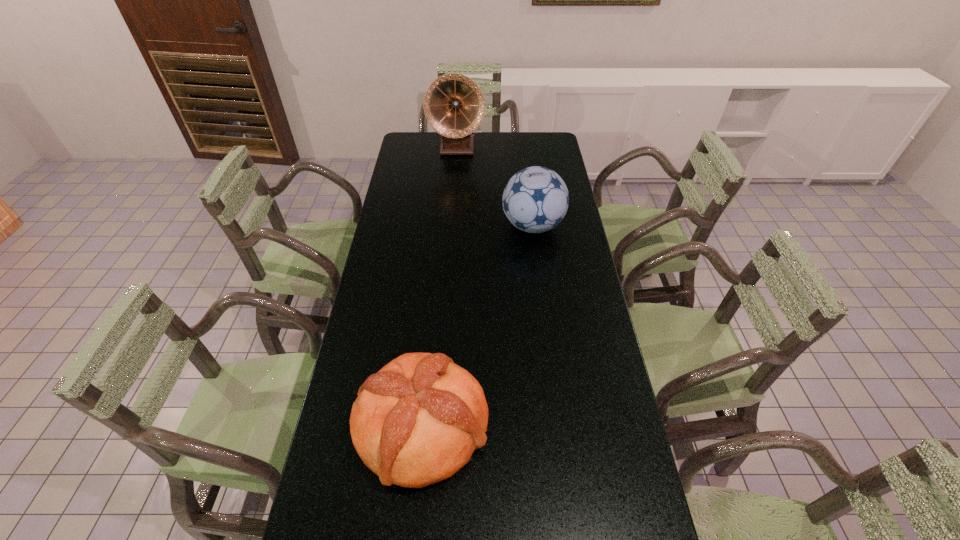
You are a GUI agent. You are given a task and a screenshot of the screen. Output one action in this format:
    pyautogui.click(x=<x>, y=<y>)
    Task: Click on the vacant space that is in between the second farthest object and the tallest object
    This screenshot has width=960, height=540.
    Given the screenshot: What is the action you would take?
    pyautogui.click(x=494, y=186)

The width and height of the screenshot is (960, 540). I want to click on empty location between the rightmost object and the phonograph record, so click(494, 186).

The image size is (960, 540). What are the coordinates of `free space between the shortest object and the tallest object` in the screenshot? It's located at (440, 286).

Locate which object is the closest to the tallest object. Please provide its 2D coordinates. Your answer should be formatted as a tuple, i.e. [(x, y)], where the tuple contains the x and y coordinates of a point satisfying the conditions above.

[(535, 200)]

Where is `the closest object to the bread`? This screenshot has height=540, width=960. the closest object to the bread is located at coordinates (535, 200).

Identify the location of free location that satisfies the following two spatial constraints: 1. on the side with brand of the rightmost object; 2. on the front side of the shortest object. The height and width of the screenshot is (540, 960). (559, 425).